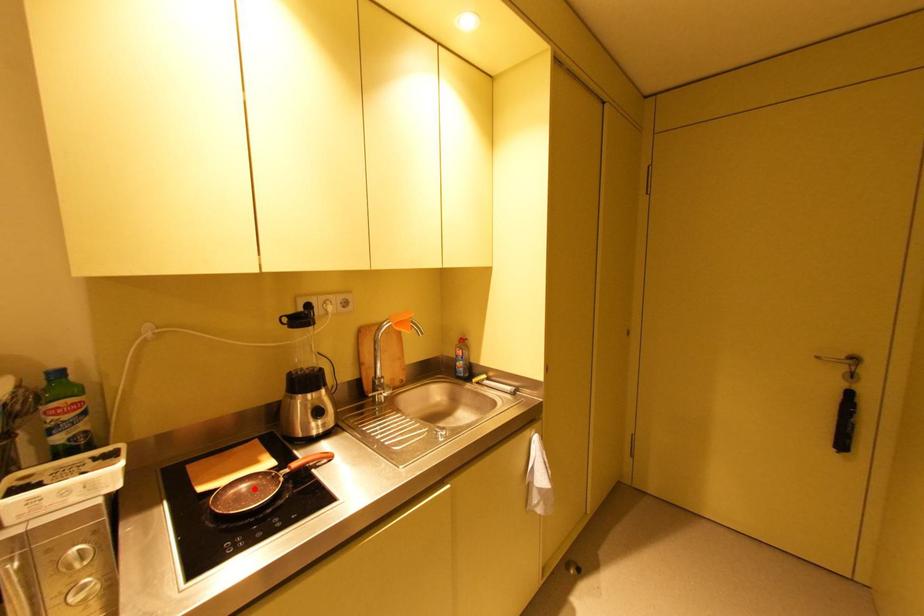
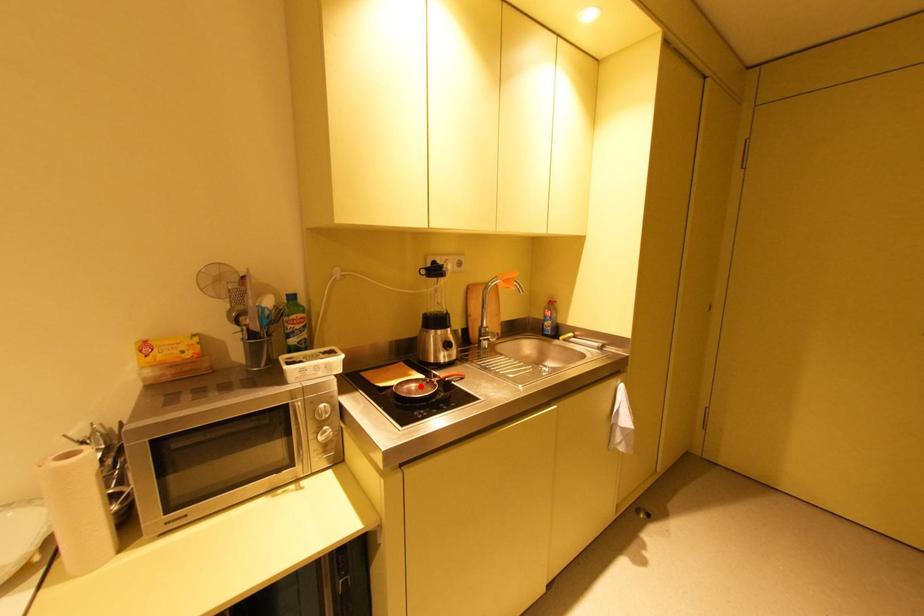
I am providing you with two images of the same scene from different viewpoints. A red point is marked on the first image and another point is marked on the second image. Do the highlighted points in image1 and image2 indicate the same real-world spot?

Yes